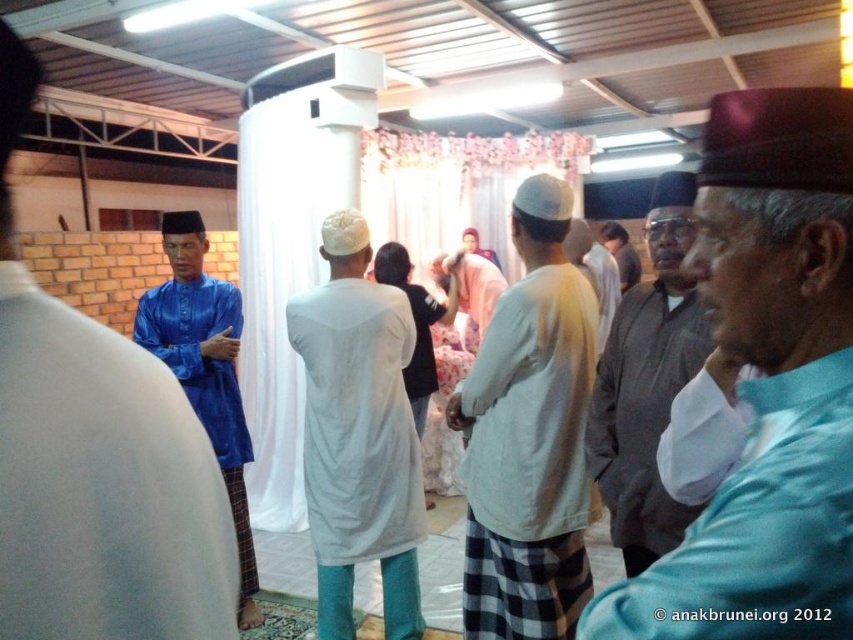
Question: Is gray matte jacket at center behind white cotton robe at center?

Choices:
 (A) yes
 (B) no

Answer: (B)

Question: Considering the real-world distances, which object is farthest from the pink satin robe at center?

Choices:
 (A) blue fabric mannequin at left
 (B) light blue shirt at center
 (C) gray matte jacket at center
 (D) blue satin kurta at left

Answer: (A)

Question: Observing the image, what is the correct spatial positioning of light blue shirt at center in reference to gray matte jacket at center?

Choices:
 (A) below
 (B) above

Answer: (B)

Question: Is the position of white cotton robe at center more distant than that of pink satin robe at center?

Choices:
 (A) no
 (B) yes

Answer: (A)

Question: Which object is positioned closest to the light gray cotton shirt at center?

Choices:
 (A) blue fabric mannequin at left
 (B) light blue shirt at center

Answer: (B)

Question: Which object appears closest to the camera in this image?

Choices:
 (A) gray matte jacket at center
 (B) blue fabric mannequin at left
 (C) light gray cotton shirt at center

Answer: (B)